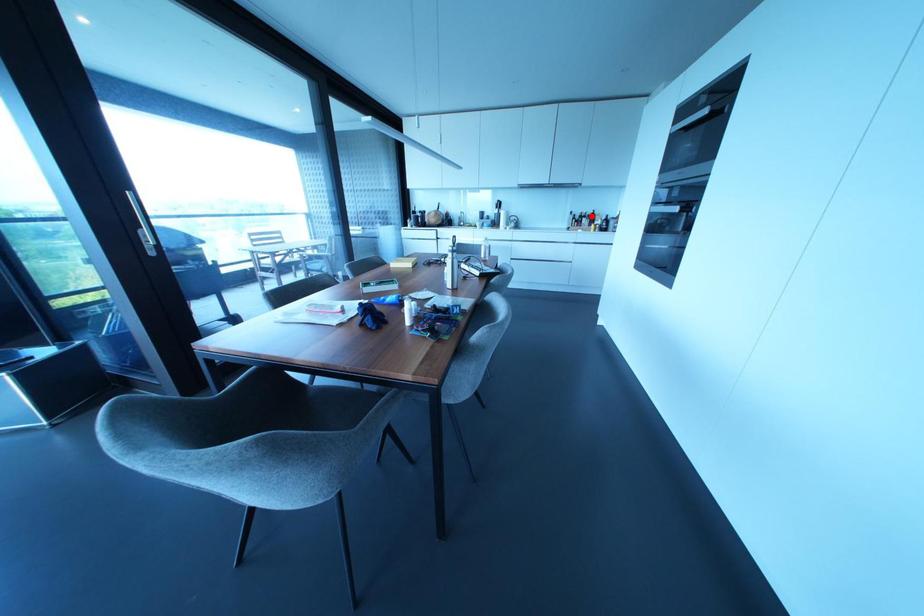
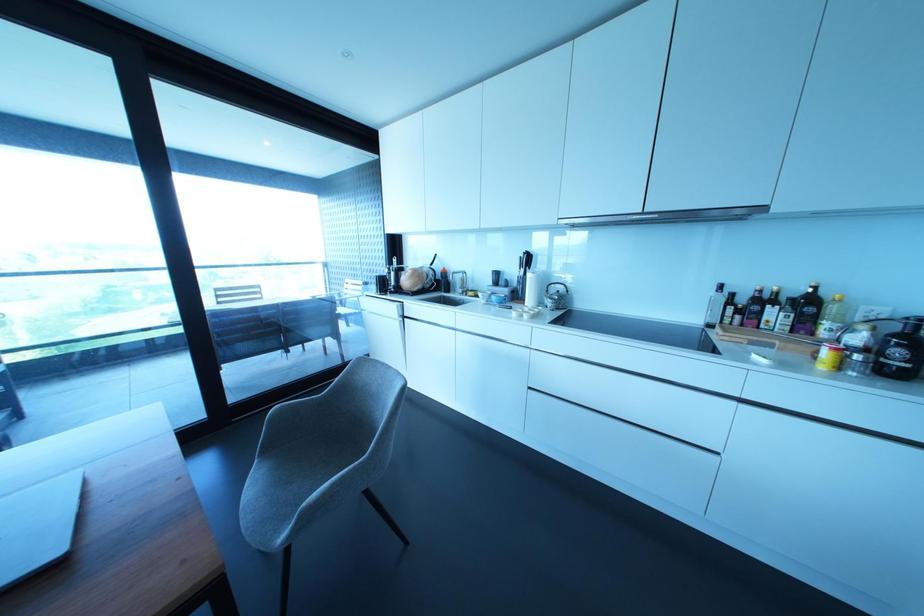
Question: I am providing you with two images of the same scene from different viewpoints. Given a red point in image1, look at the same physical point in image2. Is it:

Choices:
 (A) Closer to the viewpoint
 (B) Farther from the viewpoint

Answer: (B)